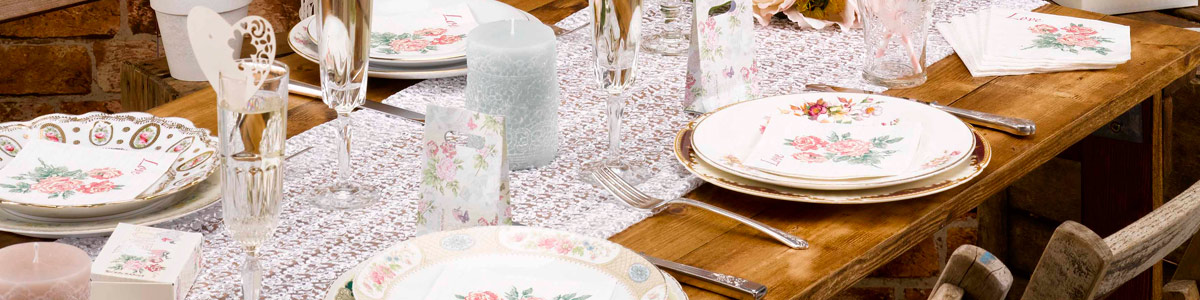
Image resolution: width=1200 pixels, height=300 pixels. What are the coordinates of `napkins` in the screenshot? It's located at (120, 165), (432, 21), (778, 153), (1018, 27), (984, 21), (972, 27), (966, 27), (955, 33), (948, 36).